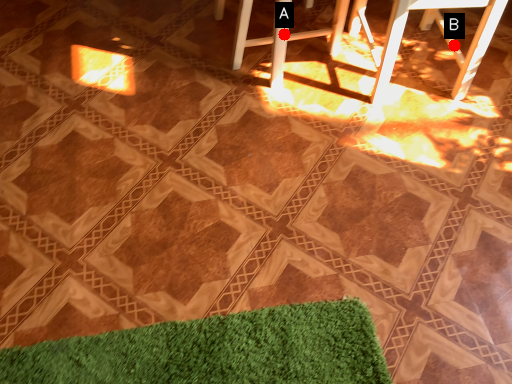
Question: Two points are circled on the image, labeled by A and B beside each circle. Among these points, which one is farthest from the camera?

Choices:
 (A) A is further
 (B) B is further

Answer: (B)